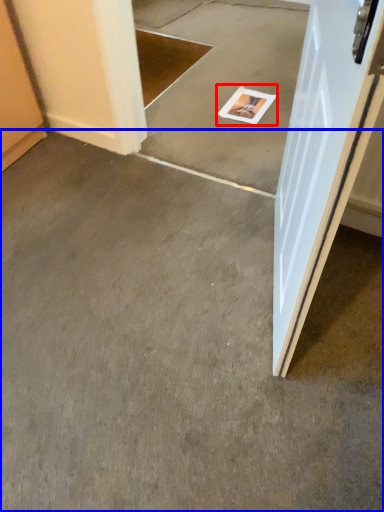
Question: Which point is further to the camera, magazine (highlighted by a red box) or concrete (highlighted by a blue box)?

Choices:
 (A) magazine
 (B) concrete

Answer: (A)